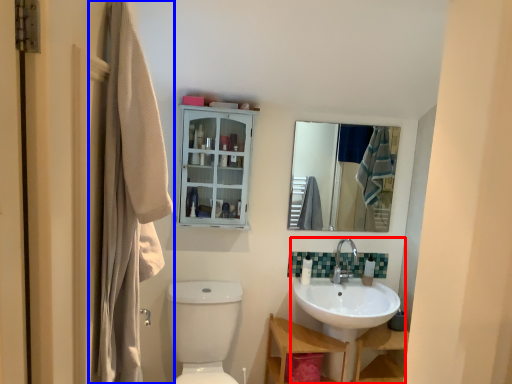
Question: Which object is closer to the camera taking this photo, sink (highlighted by a red box) or laundry (highlighted by a blue box)?

Choices:
 (A) sink
 (B) laundry

Answer: (B)